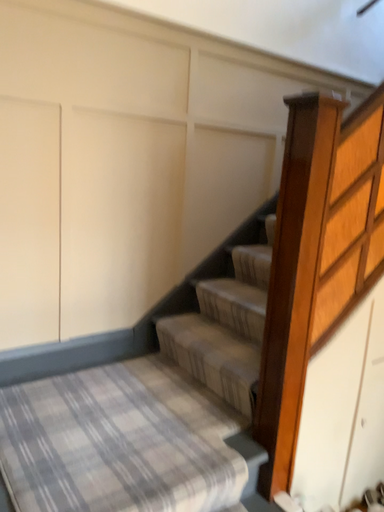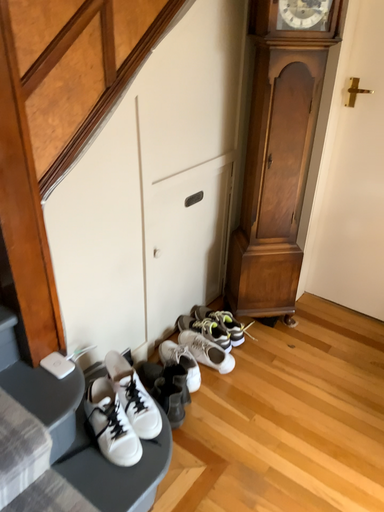
Question: Which way did the camera rotate in the video?

Choices:
 (A) rotated downward
 (B) rotated upward

Answer: (A)